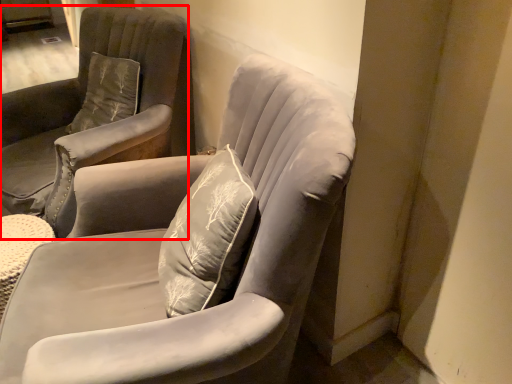
Question: From the image's perspective, where is chair (annotated by the red box) located relative to chair?

Choices:
 (A) above
 (B) below

Answer: (A)